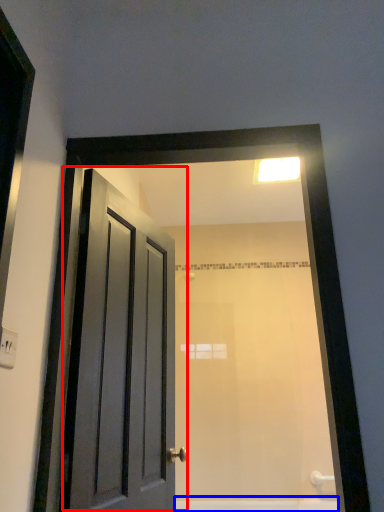
Question: Among these objects, which one is farthest to the camera, door (highlighted by a red box) or bath (highlighted by a blue box)?

Choices:
 (A) door
 (B) bath

Answer: (B)